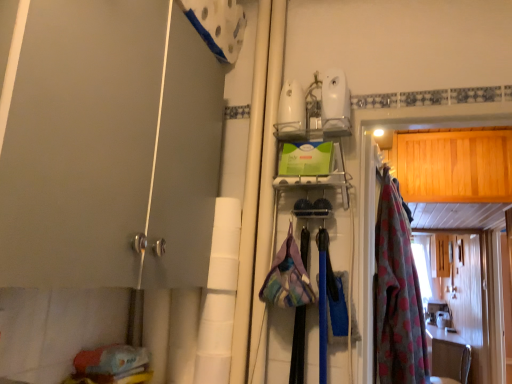
Locate an element on the screen. The image size is (512, 384). white glossy countertop at lower right is located at coordinates (448, 356).

What is the approximate width of pink floral fabric at right?

pink floral fabric at right is 6.77 inches in width.

Locate an element on the screen. Image resolution: width=512 pixels, height=384 pixels. white glossy countertop at lower right is located at coordinates (448, 356).

Does wooden cabinet at right turn towards white glossy countertop at lower right?

No, wooden cabinet at right is not turned towards white glossy countertop at lower right.

Which object is further away from the camera taking this photo, wooden cabinet at right or white glossy countertop at lower right?

wooden cabinet at right is further from the camera.

Can you confirm if wooden cabinet at right is wider than white glossy countertop at lower right?

No.

Is pink floral fabric at right in front of matte gray door at left?

No, pink floral fabric at right is further to the viewer.

Could you tell me if pink floral fabric at right is turned towards matte gray door at left?

No.

Which object is positioned more to the left, pink floral fabric at right or matte gray door at left?

matte gray door at left is more to the left.

Would you say wooden cabinet at right is part of white glossy countertop at lower right's contents?

Actually, wooden cabinet at right is outside white glossy countertop at lower right.

From a real-world perspective, is white glossy countertop at lower right beneath wooden cabinet at right?

Yes, from a real-world perspective, white glossy countertop at lower right is under wooden cabinet at right.

Considering the sizes of objects white glossy countertop at lower right and wooden cabinet at right in the image provided, who is wider, white glossy countertop at lower right or wooden cabinet at right?

white glossy countertop at lower right.

Does point (461, 364) lie behind point (432, 266)?

Yes, it is.

Which of these two, matte gray door at left or wooden cabinet at right, stands taller?

matte gray door at left is taller.

You are a GUI agent. You are given a task and a screenshot of the screen. Output one action in this format:
    pyautogui.click(x=<x>, y=<y>)
    Task: Click on the cabinetry positioned vertically above the matte gray door at left (from a real-world perspective)
    The width and height of the screenshot is (512, 384).
    Given the screenshot: What is the action you would take?
    pyautogui.click(x=440, y=254)

From the image's perspective, who appears lower, matte gray door at left or wooden cabinet at right?

wooden cabinet at right is shown below in the image.

Would you say matte gray door at left is a long distance from wooden cabinet at right?

Yes.

From the image's perspective, which object appears higher, matte gray door at left or pink floral fabric at right?

matte gray door at left.

Is matte gray door at left beside pink floral fabric at right?

No, matte gray door at left is not in contact with pink floral fabric at right.

Could you tell me if matte gray door at left is turned towards pink floral fabric at right?

No, matte gray door at left is not oriented towards pink floral fabric at right.

Between matte gray door at left and pink floral fabric at right, which one has less height?

Standing shorter between the two is matte gray door at left.

Between white glossy countertop at lower right and pink floral fabric at right, which one has larger size?

Bigger between the two is white glossy countertop at lower right.

Which object is closer to the camera taking this photo, white glossy countertop at lower right or pink floral fabric at right?

pink floral fabric at right is closer to the camera.

Find the location of a particular element. This screenshot has height=384, width=512. clothing that is in front of the white glossy countertop at lower right is located at coordinates (397, 294).

From the picture: Considering the sizes of white glossy countertop at lower right and pink floral fabric at right in the image, is white glossy countertop at lower right wider or thinner than pink floral fabric at right?

Clearly, white glossy countertop at lower right has more width compared to pink floral fabric at right.

Between wooden cabinet at right and matte gray door at left, which one has less height?

Standing shorter between the two is wooden cabinet at right.

Does wooden cabinet at right turn towards matte gray door at left?

No, wooden cabinet at right is not oriented towards matte gray door at left.

Based on the photo, does wooden cabinet at right contain matte gray door at left?

No, matte gray door at left is not surrounded by wooden cabinet at right.

Between point (449, 236) and point (17, 290), which one is positioned behind?

Point (449, 236)

In the image, there is a wooden cabinet at right. Where is `counter top below it (from a real-world perspective)`? This screenshot has width=512, height=384. counter top below it (from a real-world perspective) is located at coordinates (448, 356).

Where is `clothing behind the matte gray door at left`? clothing behind the matte gray door at left is located at coordinates (397, 294).

Looking at the image, which one is located closer to matte gray door at left, white glossy countertop at lower right or pink floral fabric at right?

Based on the image, pink floral fabric at right appears to be nearer to matte gray door at left.

Looking at the image, which one is located further to matte gray door at left, pink floral fabric at right or wooden cabinet at right?

wooden cabinet at right is positioned further to the anchor matte gray door at left.

From the image, which object appears to be nearer to pink floral fabric at right, wooden cabinet at right or white glossy countertop at lower right?

wooden cabinet at right.

When comparing their distances from pink floral fabric at right, does matte gray door at left or white glossy countertop at lower right seem further?

white glossy countertop at lower right.

From the picture: From the image, which object appears to be nearer to matte gray door at left, pink floral fabric at right or white glossy countertop at lower right?

The object closer to matte gray door at left is pink floral fabric at right.

Looking at the image, which one is located further to white glossy countertop at lower right, pink floral fabric at right or matte gray door at left?

Among the two, matte gray door at left is located further to white glossy countertop at lower right.

From the image, which object appears to be farther from pink floral fabric at right, white glossy countertop at lower right or wooden cabinet at right?

white glossy countertop at lower right.

Which object lies nearer to the anchor point white glossy countertop at lower right, wooden cabinet at right or matte gray door at left?

wooden cabinet at right lies closer to white glossy countertop at lower right than the other object.

You are a GUI agent. You are given a task and a screenshot of the screen. Output one action in this format:
    pyautogui.click(x=<x>, y=<y>)
    Task: Click on the counter top positioned between pink floral fabric at right and wooden cabinet at right from near to far
    Image resolution: width=512 pixels, height=384 pixels.
    Given the screenshot: What is the action you would take?
    pyautogui.click(x=448, y=356)

The height and width of the screenshot is (384, 512). What are the coordinates of `clothing located between matte gray door at left and wooden cabinet at right in the depth direction` in the screenshot? It's located at (397, 294).

Identify the location of clothing positioned between matte gray door at left and white glossy countertop at lower right from near to far. This screenshot has height=384, width=512. (397, 294).

The image size is (512, 384). In order to click on counter top between matte gray door at left and wooden cabinet at right from front to back in this screenshot , I will do `click(448, 356)`.